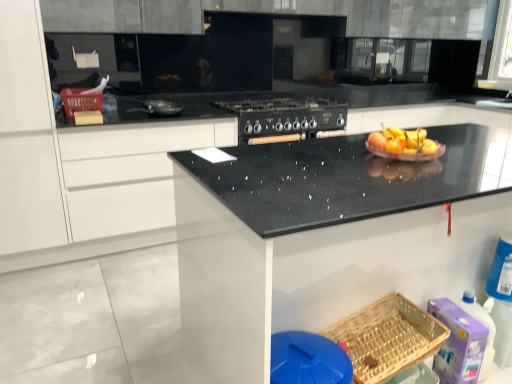
Question: Is translucent glass bowl at center situated inside woven wood basket at lower right, the 1th basket from the bottom, or outside?

Choices:
 (A) inside
 (B) outside

Answer: (B)

Question: Considering the positions of translucent glass bowl at center and woven wood basket at lower right, arranged as the second basket when viewed from the top, in the image, is translucent glass bowl at center bigger or smaller than woven wood basket at lower right, arranged as the second basket when viewed from the top,?

Choices:
 (A) small
 (B) big

Answer: (A)

Question: Considering the real-world distances, which object is closest to the matte plastic basket at upper left, which is the 2th basket in right-to-left order?

Choices:
 (A) woven wood basket at lower right, the 1th basket when ordered from right to left
 (B) black matte stove at center, placed as the 2th appliance when sorted from left to right
 (C) translucent glass bowl at center
 (D) black speckled granite at center
 (E) purple plastic cleaning product at lower right

Answer: (B)

Question: Based on their relative distances, which object is farther from the shiny silver frying pan at center, the second appliance in the back-to-front sequence?

Choices:
 (A) matte plastic basket at upper left, which is counted as the 1th basket, starting from the top
 (B) purple plastic cleaning product at lower right
 (C) woven wood basket at lower right, which is the second basket from left to right
 (D) translucent glass bowl at center
 (E) black matte stove at center, which ranks as the 1th appliance in right-to-left order

Answer: (B)